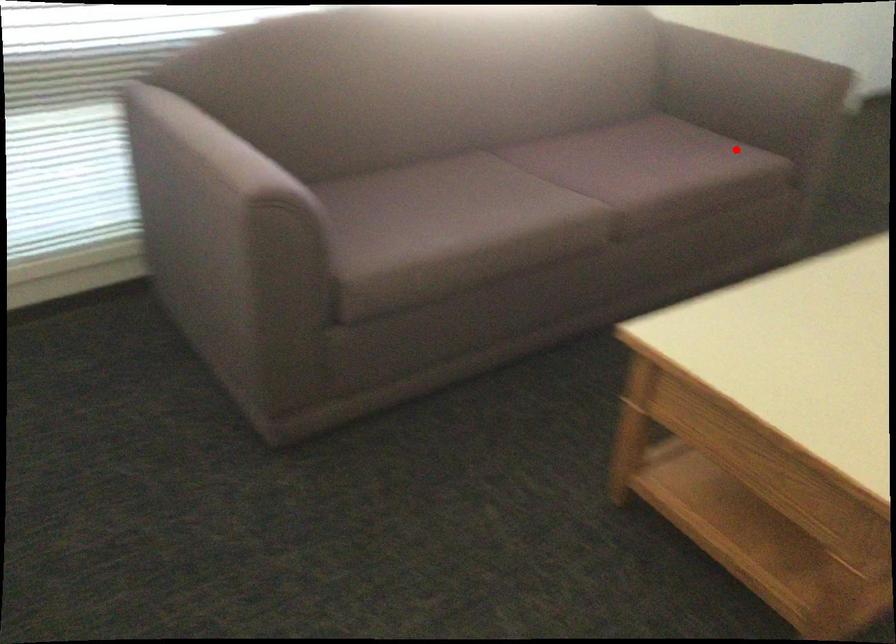
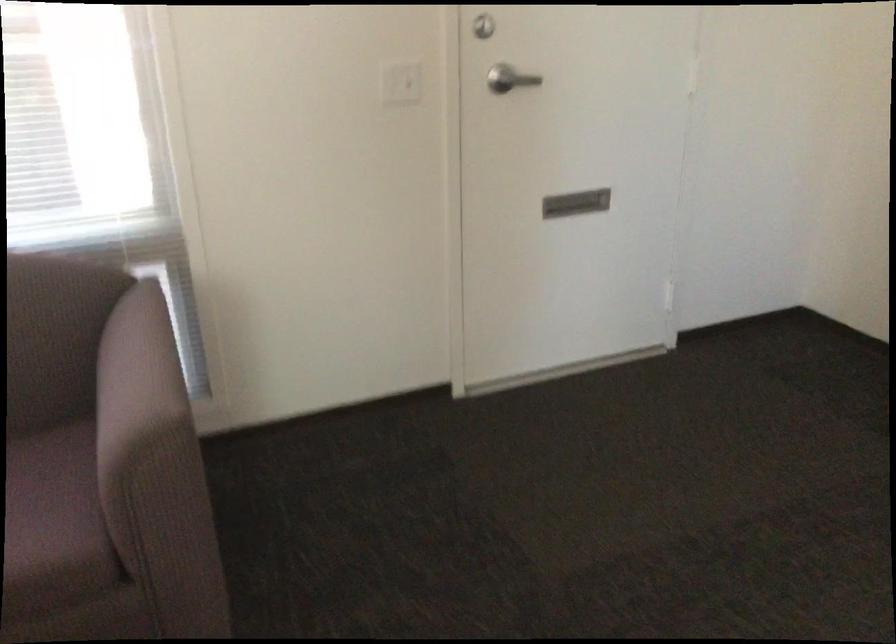
Question: I am providing you with two images of the same scene from different viewpoints. Given a red point in image1, look at the same physical point in image2. Is it:

Choices:
 (A) Closer to the viewpoint
 (B) Farther from the viewpoint

Answer: (A)